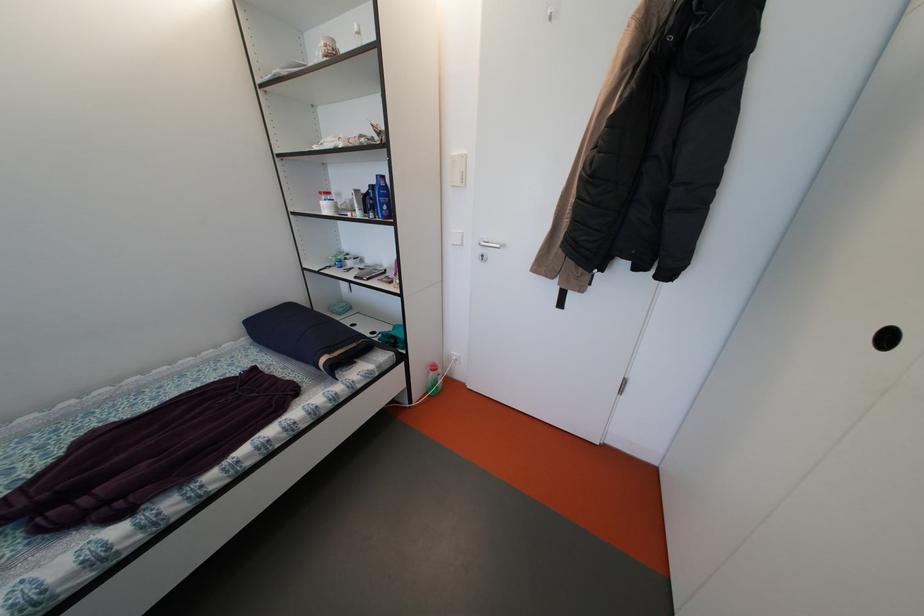
Where would you push the white light switch? Please return your answer as a coordinate pair (x, y).

(457, 169)